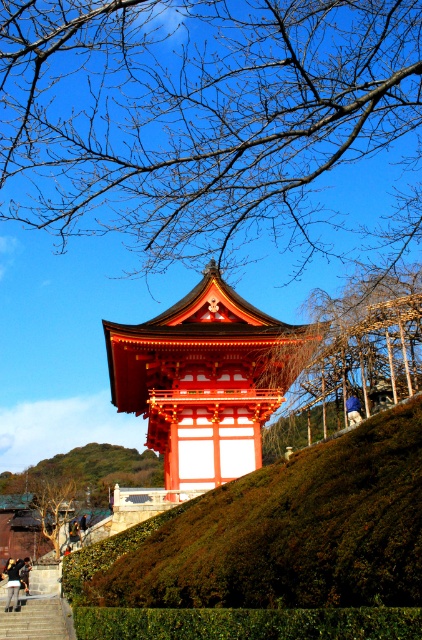
Between shiny red wood tower at center and brown textured tree at lower left, which one is positioned higher?

shiny red wood tower at center

Is point (197, 307) positioned behind point (37, 508)?

That is False.

Find the location of a particular element. The width and height of the screenshot is (422, 640). shiny red wood tower at center is located at coordinates (205, 380).

Can you confirm if green leafy tree at lower left is shorter than blue fabric person at center?

No.

Which is below, green leafy tree at lower left or blue fabric person at center?

green leafy tree at lower left

Between point (127, 483) and point (349, 394), which one is positioned behind?

The point (127, 483) is behind.

Image resolution: width=422 pixels, height=640 pixels. In order to click on green leafy tree at lower left in this screenshot , I will do `click(91, 470)`.

Who is taller, shiny red wood tower at center or blue fabric person at center?

With more height is shiny red wood tower at center.

Image resolution: width=422 pixels, height=640 pixels. What are the coordinates of `shiny red wood tower at center` in the screenshot? It's located at (205, 380).

Image resolution: width=422 pixels, height=640 pixels. I want to click on shiny red wood tower at center, so click(x=205, y=380).